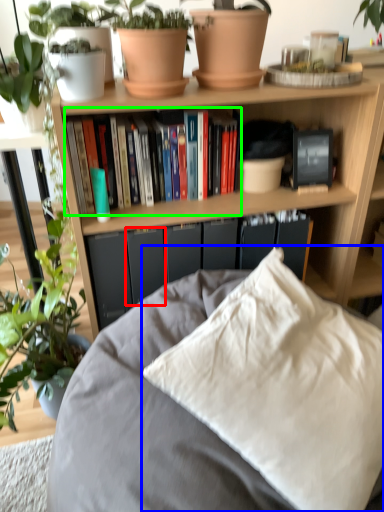
Question: Which is farther away from paperback book (highlighted by a red box)? pillow (highlighted by a blue box) or book (highlighted by a green box)?

Choices:
 (A) pillow
 (B) book

Answer: (A)